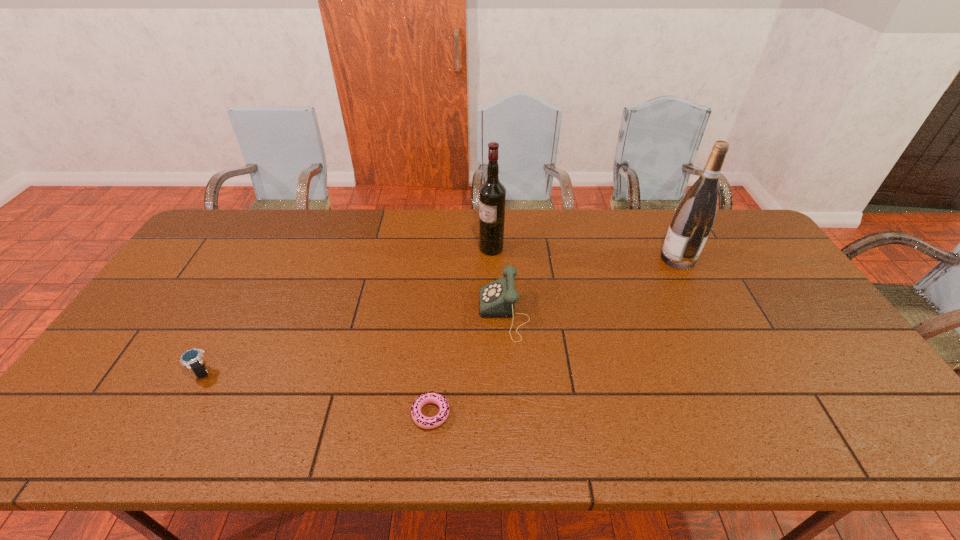
Identify the location of vacant space located on the label of the right wine bottle. Image resolution: width=960 pixels, height=540 pixels. (556, 259).

The width and height of the screenshot is (960, 540). I want to click on vacant point located 0.080m on the front and back of the left wine bottle, so click(x=455, y=248).

This screenshot has height=540, width=960. In order to click on vacant space located on the front and back of the left wine bottle in this screenshot , I will do `click(437, 248)`.

Identify the location of free location located 0.370m on the front and back of the left wine bottle. This screenshot has width=960, height=540. (369, 248).

Image resolution: width=960 pixels, height=540 pixels. Identify the location of vacant area situated 0.300m on the dial of the third shortest object. (374, 314).

Image resolution: width=960 pixels, height=540 pixels. What are the coordinates of `blank space located 0.190m on the dial of the third shortest object` in the screenshot? It's located at (413, 314).

Where is `blank space located on the dial of the third shortest object`? This screenshot has height=540, width=960. blank space located on the dial of the third shortest object is located at coordinates (430, 314).

At what (x,y) coordinates should I click in order to perform the action: click on vacant position located 0.270m on the back of the fourth tallest object. Please return your answer as a coordinate pair (x, y). The width and height of the screenshot is (960, 540). Looking at the image, I should click on (248, 287).

This screenshot has height=540, width=960. I want to click on free region located 0.210m on the back of the doughnut, so click(439, 330).

The image size is (960, 540). Find the location of `object that is at the near edge`. object that is at the near edge is located at coordinates (432, 397).